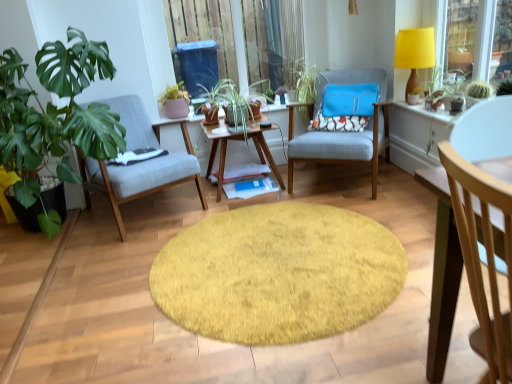
Question: Does matte gray chair at left, the second chair viewed from the front, have a lesser height compared to light wood chair at right, arranged as the first chair when viewed from the front?

Choices:
 (A) yes
 (B) no

Answer: (A)

Question: Is matte gray chair at left, the second chair viewed from the front, positioned behind light wood chair at right, placed as the third chair when sorted from left to right?

Choices:
 (A) no
 (B) yes

Answer: (B)

Question: Does matte gray chair at left, the first chair in the left-to-right sequence, have a greater width compared to light wood chair at right, marked as the 1th chair in a right-to-left arrangement?

Choices:
 (A) yes
 (B) no

Answer: (A)

Question: Is matte gray chair at left, the second chair viewed from the front, thinner than light wood chair at right, marked as the 1th chair in a right-to-left arrangement?

Choices:
 (A) no
 (B) yes

Answer: (A)

Question: Is matte gray chair at left, placed as the 3th chair when sorted from right to left, beside light wood chair at right, marked as the 1th chair in a right-to-left arrangement?

Choices:
 (A) no
 (B) yes

Answer: (A)

Question: Is point (169, 122) positioned closer to the camera than point (415, 84)?

Choices:
 (A) closer
 (B) farther

Answer: (B)

Question: Is woodenobject at center in front of or behind yellow fabric lampshade at upper right in the image?

Choices:
 (A) front
 (B) behind

Answer: (A)

Question: In terms of size, does woodenobject at center appear bigger or smaller than yellow fabric lampshade at upper right?

Choices:
 (A) big
 (B) small

Answer: (A)

Question: From the image's perspective, is woodenobject at center above or below yellow fabric lampshade at upper right?

Choices:
 (A) above
 (B) below

Answer: (B)

Question: Is point (276, 61) closer or farther from the camera than point (300, 69)?

Choices:
 (A) closer
 (B) farther

Answer: (A)

Question: Which is correct: transparent plastic window screen at upper center is inside green leafy plant at center, or outside of it?

Choices:
 (A) inside
 (B) outside

Answer: (B)

Question: Is transparent plastic window screen at upper center bigger or smaller than green leafy plant at center?

Choices:
 (A) big
 (B) small

Answer: (A)

Question: From a real-world perspective, is transparent plastic window screen at upper center positioned above or below green leafy plant at center?

Choices:
 (A) above
 (B) below

Answer: (A)

Question: Based on their sizes in the image, would you say woodenobject at center is bigger or smaller than matte pink pot at center, the 1th houseplant in the right-to-left sequence?

Choices:
 (A) small
 (B) big

Answer: (B)

Question: Considering their positions, is woodenobject at center located in front of or behind matte pink pot at center, the second houseplant positioned from the left?

Choices:
 (A) behind
 (B) front

Answer: (B)